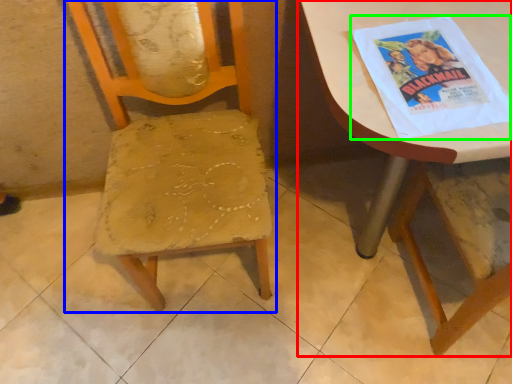
Question: Which is nearer to the table (highlighted by a red box)? chair (highlighted by a blue box) or comic book (highlighted by a green box).

Choices:
 (A) chair
 (B) comic book

Answer: (B)